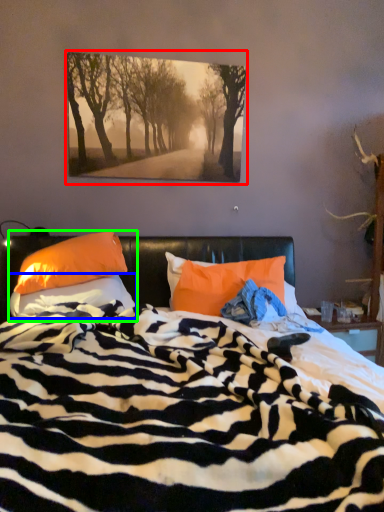
Question: Considering the real-world distances, which object is closest to picture frame (highlighted by a red box)? pillow (highlighted by a blue box) or pillow (highlighted by a green box).

Choices:
 (A) pillow
 (B) pillow

Answer: (B)